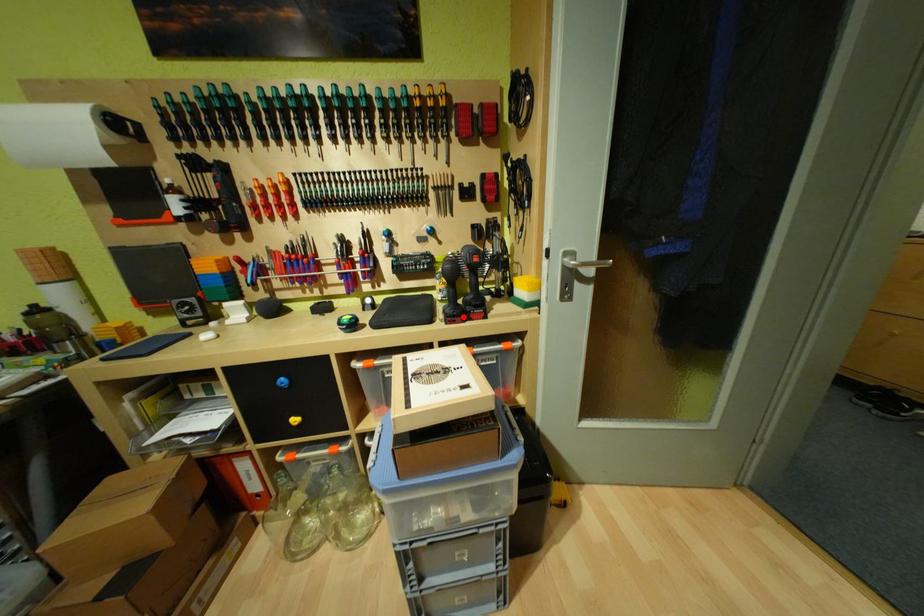
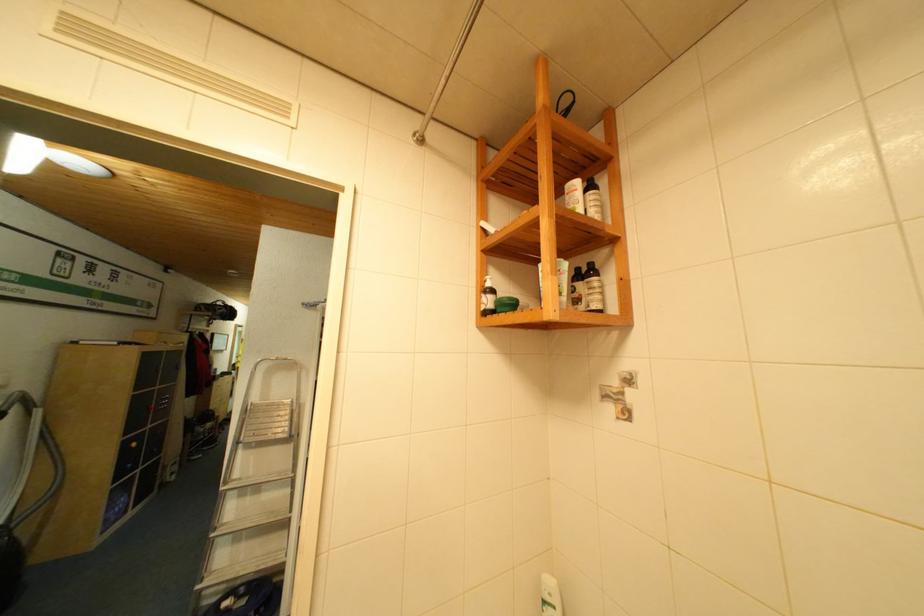
Question: I am providing you with two images of the same scene from different viewpoints. A red point is marked on the first image. Is the red point's position out of view in image 2?

Choices:
 (A) Yes
 (B) No

Answer: (A)